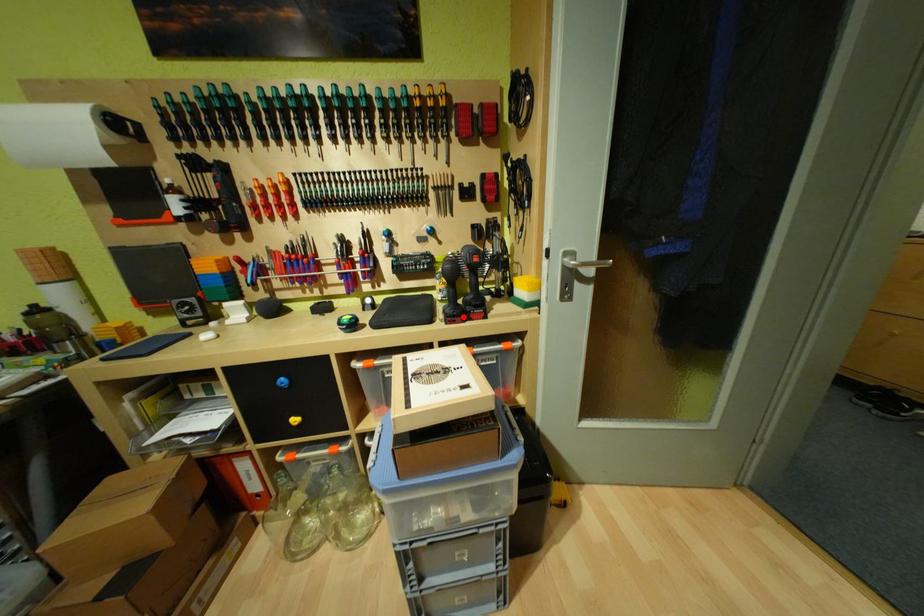
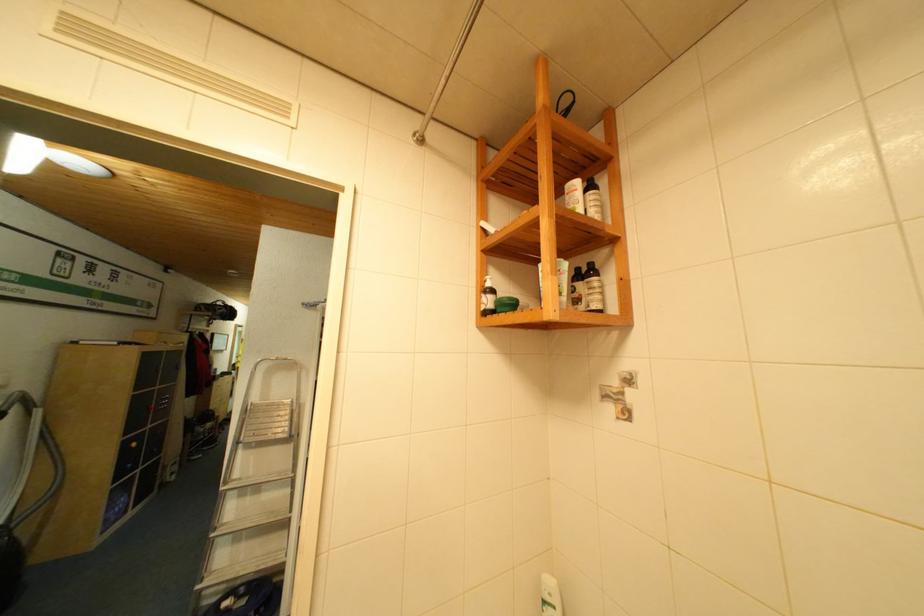
Question: I am providing you with two images of the same scene from different viewpoints. A red point is marked on the first image. Is the red point's position out of view in image 2?

Choices:
 (A) Yes
 (B) No

Answer: (A)